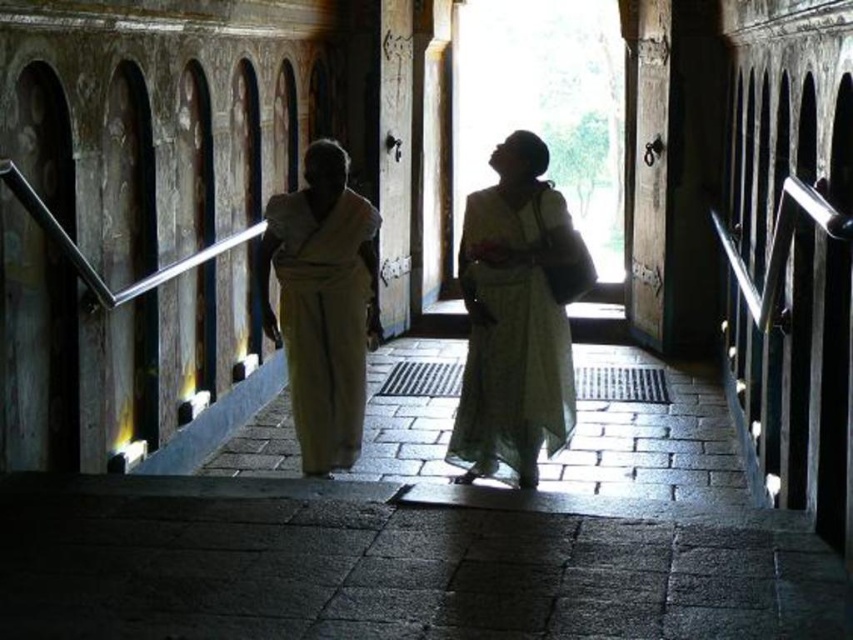
Which is below, white sheer dress at center or light beige fabric monk at center?

white sheer dress at center is below.

I want to click on white sheer dress at center, so click(x=514, y=332).

Between point (468, 401) and point (260, 296), which one is positioned behind?

Point (260, 296)

Find the location of a particular element. white sheer dress at center is located at coordinates (514, 332).